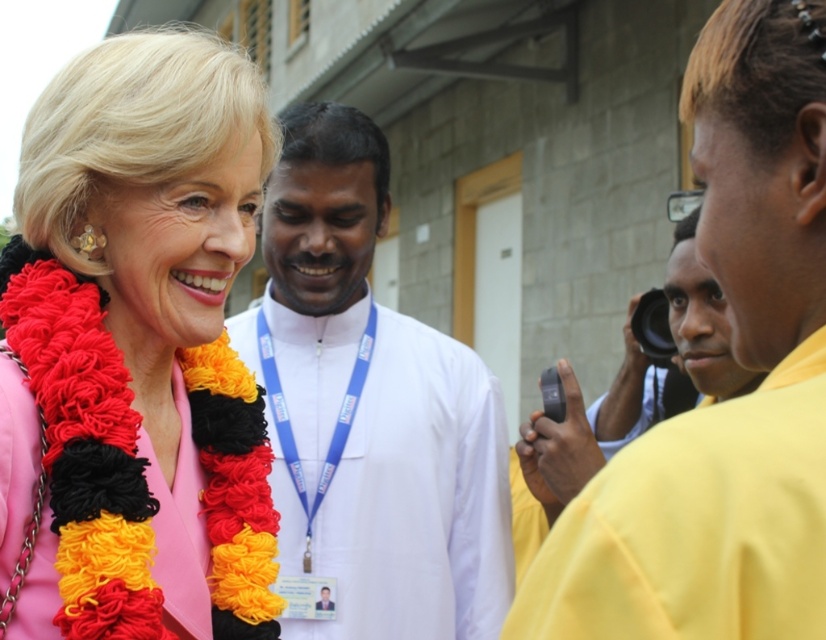
Based on the scene description, which object is shorter, the yellow fabric at right or the white cloth at center?

The yellow fabric at right is shorter than the white cloth at center.